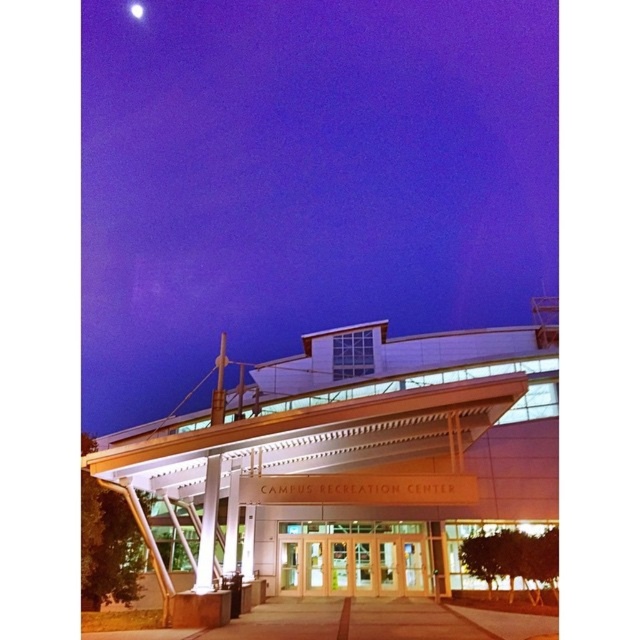
Can you confirm if clear glass doors at center is positioned below bright white sphere at upper center?

Yes, clear glass doors at center is below bright white sphere at upper center.

Who is positioned more to the right, clear glass doors at center or bright white sphere at upper center?

clear glass doors at center is more to the right.

Who is more forward, (282, 554) or (132, 13)?

Result: Point (282, 554)

Find the location of a particular element. clear glass doors at center is located at coordinates pyautogui.click(x=358, y=560).

Who is lower down, white glossy pillar at center or bright white sphere at upper center?

white glossy pillar at center is below.

Is point (198, 547) positioned in front of point (134, 6)?

Yes, point (198, 547) is in front of point (134, 6).

I want to click on white glossy pillar at center, so click(x=208, y=525).

Who is positioned more to the right, clear glass doors at center or white glossy pillar at center?

clear glass doors at center

Who is more distant from viewer, (276, 573) or (212, 483)?

Positioned behind is point (276, 573).

Is point (304, 563) closer to viewer compared to point (200, 538)?

No, (304, 563) is behind (200, 538).

You are a GUI agent. You are given a task and a screenshot of the screen. Output one action in this format:
    pyautogui.click(x=<x>, y=<y>)
    Task: Click on the clear glass doors at center
    
    Given the screenshot: What is the action you would take?
    pyautogui.click(x=358, y=560)